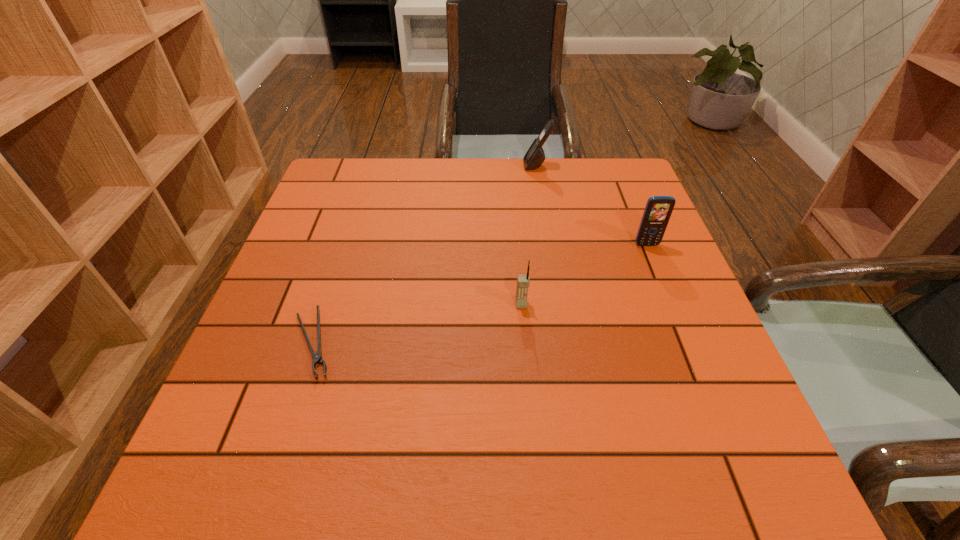
The image size is (960, 540). I want to click on free location located on the front-facing side of the second cellular telephone from left to right, so click(504, 165).

Where is `free space located on the screen of the rightmost object`? This screenshot has width=960, height=540. free space located on the screen of the rightmost object is located at coordinates (688, 348).

Image resolution: width=960 pixels, height=540 pixels. In order to click on vacant area located 0.260m on the front of the leftmost cellular telephone, where the keypad is located in this screenshot , I will do `click(532, 424)`.

Find the location of `free space located on the right of the tongs`. free space located on the right of the tongs is located at coordinates (468, 343).

Where is `object situated at the far edge`? This screenshot has height=540, width=960. object situated at the far edge is located at coordinates (535, 156).

Identify the location of object positioned at the left edge. The image size is (960, 540). (317, 358).

Identify the location of object that is positioned at the right edge. (658, 209).

Image resolution: width=960 pixels, height=540 pixels. In the image, there is a desktop. What are the coordinates of `free space at the far edge` in the screenshot? It's located at (492, 192).

Identify the location of free region at the left edge of the desktop. The height and width of the screenshot is (540, 960). coord(281,293).

Locate an element on the screen. The width and height of the screenshot is (960, 540). vacant space at the right edge of the desktop is located at coordinates (679, 367).